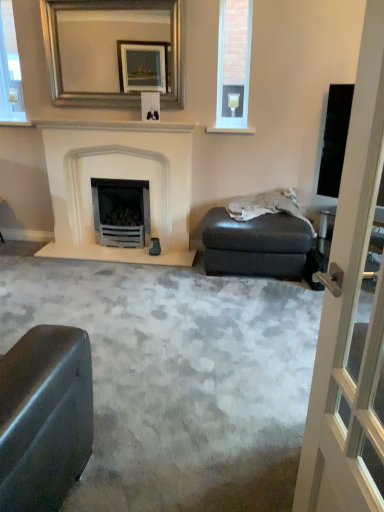
Question: Is silver/golden-framed mirror at upper center outside white glossy window frame at upper left?

Choices:
 (A) no
 (B) yes

Answer: (B)

Question: From a real-world perspective, is silver/golden-framed mirror at upper center beneath white glossy window frame at upper left?

Choices:
 (A) no
 (B) yes

Answer: (A)

Question: Considering the relative positions of silver/golden-framed mirror at upper center and white glossy window frame at upper left in the image provided, is silver/golden-framed mirror at upper center to the left of white glossy window frame at upper left from the viewer's perspective?

Choices:
 (A) no
 (B) yes

Answer: (A)

Question: Is silver/golden-framed mirror at upper center turned away from white glossy window frame at upper left?

Choices:
 (A) yes
 (B) no

Answer: (B)

Question: Is the position of silver/golden-framed mirror at upper center less distant than that of white glossy window frame at upper left?

Choices:
 (A) no
 (B) yes

Answer: (B)

Question: Considering the positions of black glossy screen door at right and white stone fireplace at center in the image, is black glossy screen door at right bigger or smaller than white stone fireplace at center?

Choices:
 (A) big
 (B) small

Answer: (B)

Question: Is black glossy screen door at right wider or thinner than white stone fireplace at center?

Choices:
 (A) thin
 (B) wide

Answer: (A)

Question: Considering the positions of point (339, 495) and point (74, 156), is point (339, 495) closer or farther from the camera than point (74, 156)?

Choices:
 (A) closer
 (B) farther

Answer: (A)

Question: Visually, is black glossy screen door at right positioned to the left or to the right of white stone fireplace at center?

Choices:
 (A) right
 (B) left

Answer: (A)

Question: Considering the relative positions of clear glass window at upper right and silver/golden-framed mirror at upper center in the image provided, is clear glass window at upper right to the left or to the right of silver/golden-framed mirror at upper center?

Choices:
 (A) left
 (B) right

Answer: (B)

Question: Relative to silver/golden-framed mirror at upper center, is clear glass window at upper right in front or behind?

Choices:
 (A) behind
 (B) front

Answer: (A)

Question: Considering the positions of point (220, 74) and point (76, 76), is point (220, 74) closer or farther from the camera than point (76, 76)?

Choices:
 (A) closer
 (B) farther

Answer: (B)

Question: From a real-world perspective, is clear glass window at upper right positioned above or below silver/golden-framed mirror at upper center?

Choices:
 (A) above
 (B) below

Answer: (B)

Question: From the image's perspective, is white stone fireplace at center positioned above or below black glossy screen door at right?

Choices:
 (A) below
 (B) above

Answer: (B)

Question: From their relative heights in the image, would you say white stone fireplace at center is taller or shorter than black glossy screen door at right?

Choices:
 (A) tall
 (B) short

Answer: (B)